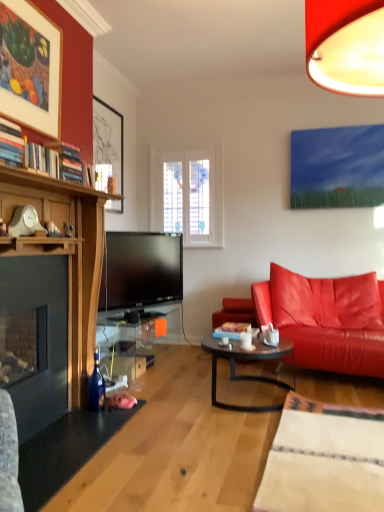
Locate an element on the screen. blank space to the left of white ceramic mug at center is located at coordinates (233, 345).